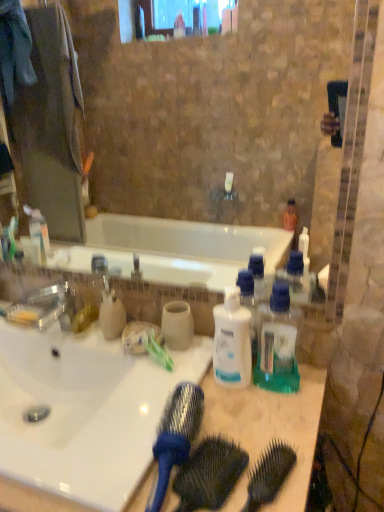
This screenshot has width=384, height=512. I want to click on vacant area that lies to the right of green plastic toothbrush at center, so click(x=231, y=384).